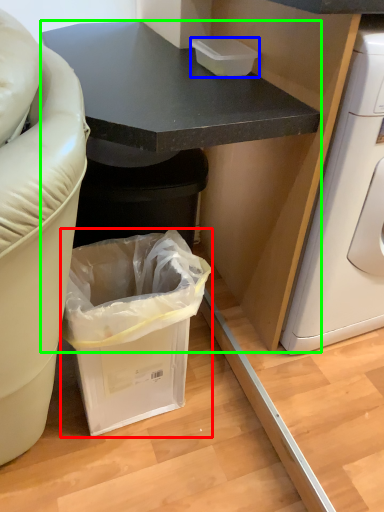
Question: Estimate the real-world distances between objects in this image. Which object is closer to trash bin/can (highlighted by a red box), box (highlighted by a blue box) or cabinetry (highlighted by a green box)?

Choices:
 (A) box
 (B) cabinetry

Answer: (B)